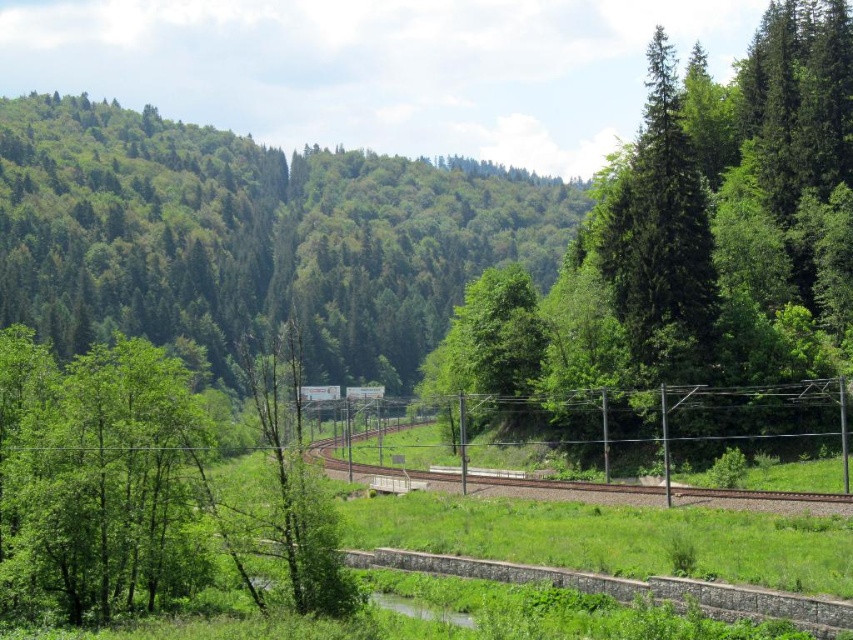
Who is shorter, green forested hillside at left or green leafy tree at left?

Standing shorter between the two is green leafy tree at left.

Who is positioned more to the right, green forested hillside at left or green leafy tree at left?

green leafy tree at left is more to the right.

Is point (256, 266) positioned after point (105, 451)?

Yes, point (256, 266) is farther from viewer.

Find the location of a particular element. This screenshot has height=640, width=853. green forested hillside at left is located at coordinates (252, 237).

Does point (126, 237) come closer to viewer compared to point (598, 230)?

No, it is not.

Who is lower down, green forested hillside at left or green textured tree at center?

Positioned lower is green textured tree at center.

Is point (463, 186) farther from viewer compared to point (759, 237)?

Yes, point (463, 186) is farther from viewer.

The image size is (853, 640). What are the coordinates of `green forested hillside at left` in the screenshot? It's located at (252, 237).

Is green leafy tree at left below metallic wire fence at center?

No, green leafy tree at left is not below metallic wire fence at center.

Does green leafy tree at left appear over metallic wire fence at center?

Yes.

Which is in front, point (10, 467) or point (741, 408)?

Point (10, 467)

Find the location of a particular element. The width and height of the screenshot is (853, 640). green leafy tree at left is located at coordinates (142, 493).